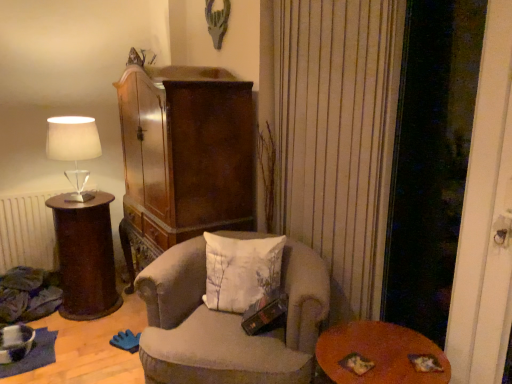
Question: Does brown wood side table at left turn towards white cotton pillow at center?

Choices:
 (A) no
 (B) yes

Answer: (A)

Question: From the image's perspective, is brown wood side table at left beneath white cotton pillow at center?

Choices:
 (A) yes
 (B) no

Answer: (A)

Question: Is brown wood side table at left positioned in front of white cotton pillow at center?

Choices:
 (A) no
 (B) yes

Answer: (A)

Question: Can you confirm if brown wood side table at left is bigger than white cotton pillow at center?

Choices:
 (A) yes
 (B) no

Answer: (A)

Question: Does brown wood side table at left appear on the right side of white cotton pillow at center?

Choices:
 (A) yes
 (B) no

Answer: (B)

Question: Is brown wood side table at left not close to white cotton pillow at center?

Choices:
 (A) yes
 (B) no

Answer: (A)

Question: From the image's perspective, is transparent glass screen door at right below white cotton pillow at center?

Choices:
 (A) no
 (B) yes

Answer: (A)

Question: Does transparent glass screen door at right have a smaller size compared to white cotton pillow at center?

Choices:
 (A) yes
 (B) no

Answer: (B)

Question: Is transparent glass screen door at right outside white cotton pillow at center?

Choices:
 (A) yes
 (B) no

Answer: (A)

Question: Is transparent glass screen door at right wider than white cotton pillow at center?

Choices:
 (A) yes
 (B) no

Answer: (B)

Question: Can you confirm if transparent glass screen door at right is bigger than white cotton pillow at center?

Choices:
 (A) no
 (B) yes

Answer: (B)

Question: Does transparent glass screen door at right appear on the left side of white cotton pillow at center?

Choices:
 (A) no
 (B) yes

Answer: (A)

Question: From a real-world perspective, is velvet beige armchair at center located higher than wooden round table at lower right?

Choices:
 (A) yes
 (B) no

Answer: (A)